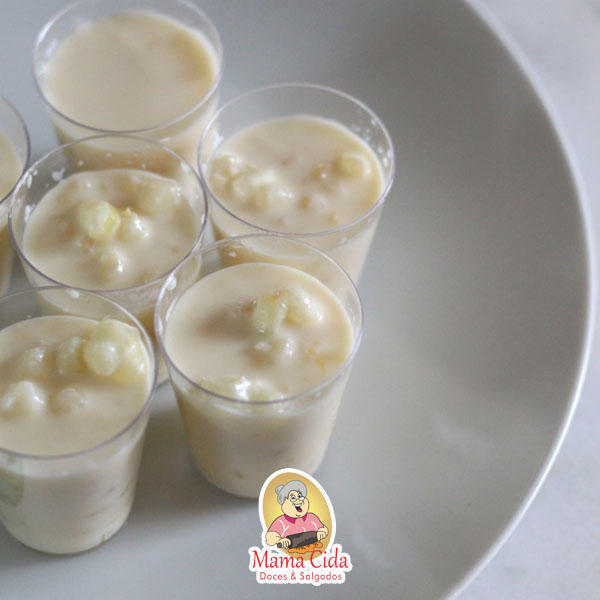
Find the location of a particular element. This screenshot has width=600, height=600. plate is located at coordinates (510, 139).